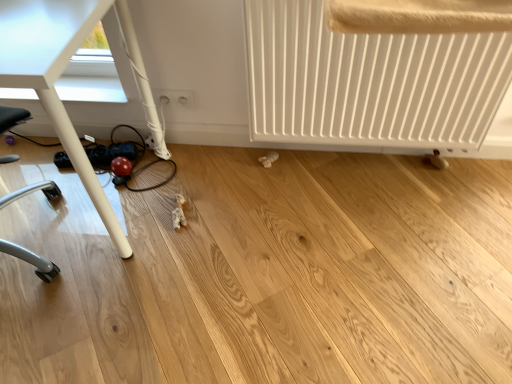
Question: From a real-world perspective, is white glossy table at lower left below white matte radiator at lower right?

Choices:
 (A) yes
 (B) no

Answer: (B)

Question: Is white glossy table at lower left oriented away from white matte radiator at lower right?

Choices:
 (A) yes
 (B) no

Answer: (B)

Question: Is white glossy table at lower left aimed at white matte radiator at lower right?

Choices:
 (A) yes
 (B) no

Answer: (B)

Question: Does white glossy table at lower left have a greater height compared to white matte radiator at lower right?

Choices:
 (A) no
 (B) yes

Answer: (B)

Question: Is the depth of white glossy table at lower left greater than that of white matte radiator at lower right?

Choices:
 (A) no
 (B) yes

Answer: (A)

Question: In the image, is white glossy table at lower left on the left side or the right side of white matte radiator at lower right?

Choices:
 (A) right
 (B) left

Answer: (B)

Question: Would you say white glossy table at lower left is inside or outside white matte radiator at lower right?

Choices:
 (A) outside
 (B) inside

Answer: (A)

Question: Is white glossy table at lower left in front of or behind white matte radiator at lower right in the image?

Choices:
 (A) behind
 (B) front

Answer: (B)

Question: From the image's perspective, is white glossy table at lower left above or below white matte radiator at lower right?

Choices:
 (A) below
 (B) above

Answer: (A)

Question: Looking at their shapes, would you say white plastic outlets at lower center is wider or thinner than white matte radiator at lower right?

Choices:
 (A) thin
 (B) wide

Answer: (A)

Question: From a real-world perspective, is white plastic outlets at lower center positioned above or below white matte radiator at lower right?

Choices:
 (A) above
 (B) below

Answer: (B)

Question: Choose the correct answer: Is white plastic outlets at lower center inside white matte radiator at lower right or outside it?

Choices:
 (A) inside
 (B) outside

Answer: (B)

Question: From their relative heights in the image, would you say white plastic outlets at lower center is taller or shorter than white matte radiator at lower right?

Choices:
 (A) short
 (B) tall

Answer: (A)

Question: Considering the positions of white glossy table at lower left and white plastic outlets at lower center in the image, is white glossy table at lower left taller or shorter than white plastic outlets at lower center?

Choices:
 (A) tall
 (B) short

Answer: (A)

Question: Is point (11, 67) positioned closer to the camera than point (186, 105)?

Choices:
 (A) farther
 (B) closer

Answer: (B)